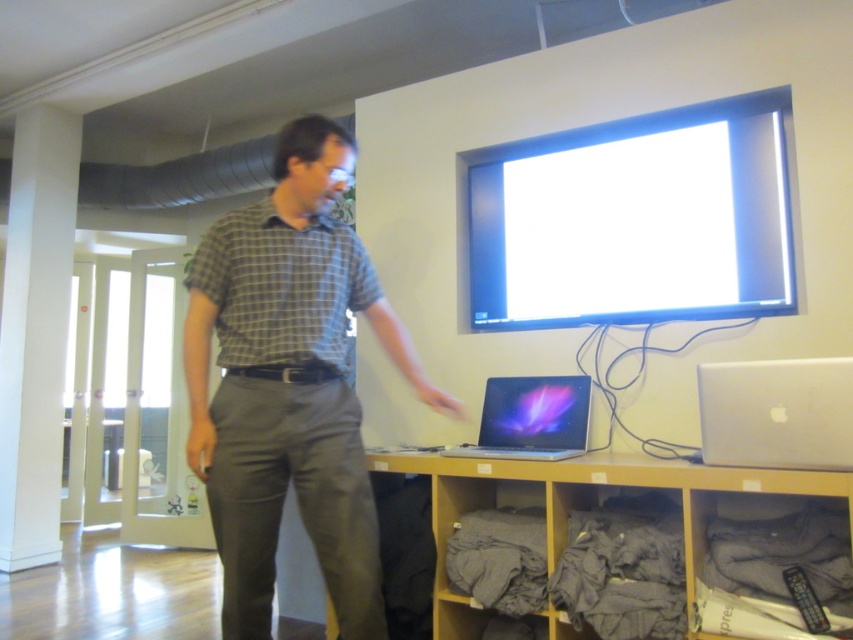
You are an interior designer observing the office layout. You need to determine if the plaid shirt at center and the white smooth pillar at left can both fit on a 1.2 meter wide shelf. Based on their sizes, will they fit together?

The plaid shirt at center is smaller than the white smooth pillar at left. However, without knowing their exact dimensions, it is impossible to determine if they can fit together on a 1.2 meter wide shelf. Additional information about their sizes is needed.

You are standing in the office scene. You need to locate the plaid shirt at center. Where would you look in terms of left, right, up, or down?

The plaid shirt at center is located at the center of the image, so you should look straight ahead or directly in the middle of the scene.